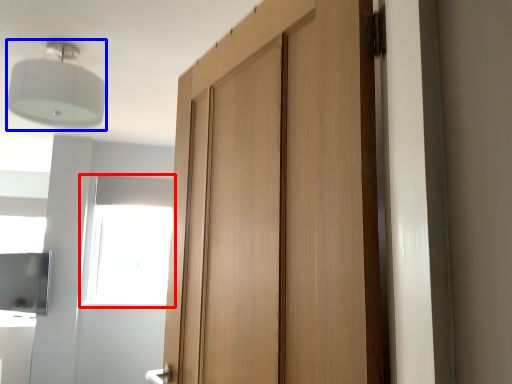
Question: Which point is closer to the camera, window (highlighted by a red box) or light fixture (highlighted by a blue box)?

Choices:
 (A) window
 (B) light fixture

Answer: (B)